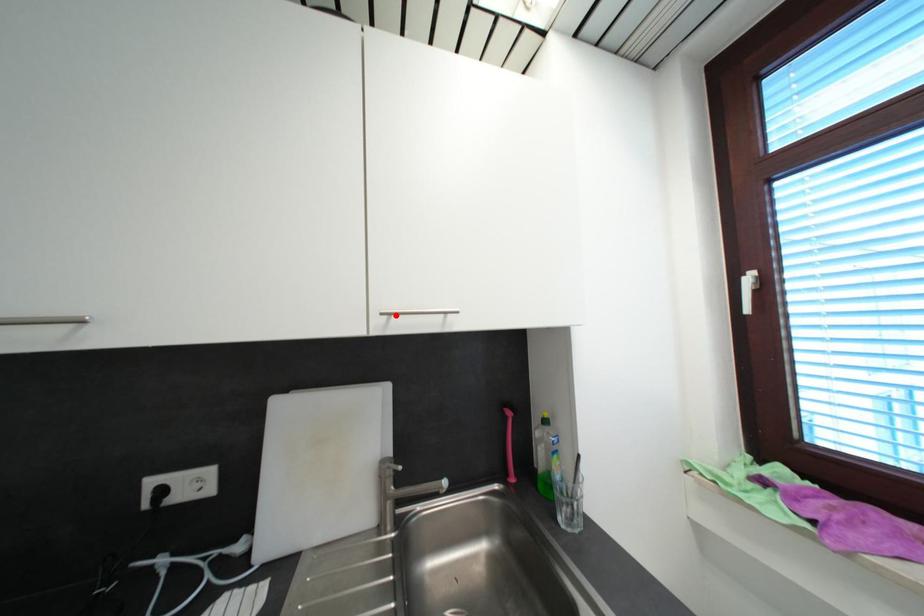
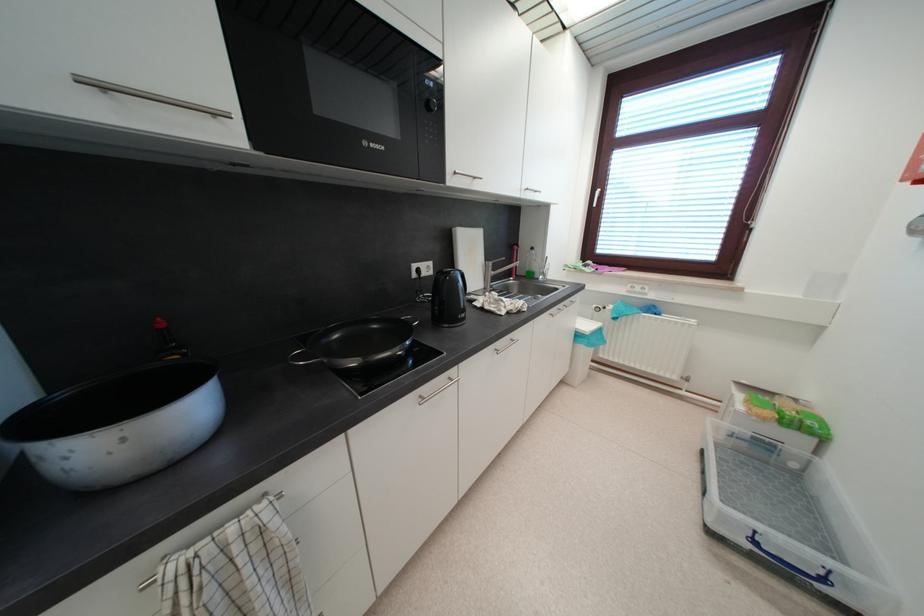
Question: I am providing you with two images of the same scene from different viewpoints. A red point is marked on the first image. At the location where the point appears in image 1, is it still visible in image 2?

Choices:
 (A) Yes
 (B) No

Answer: (A)